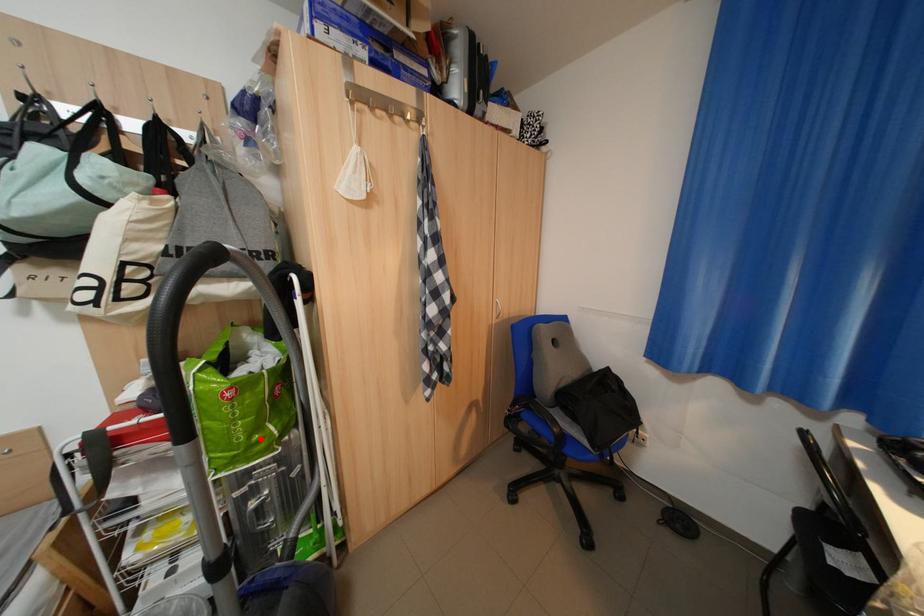
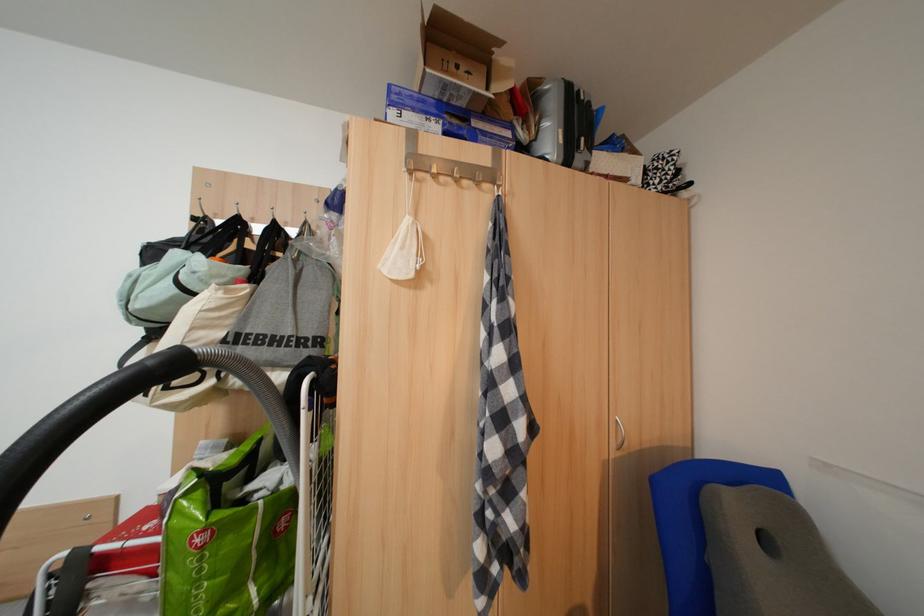
Locate, in the second image, the point that corresponds to the highlighted location in the first image.

(225, 610)